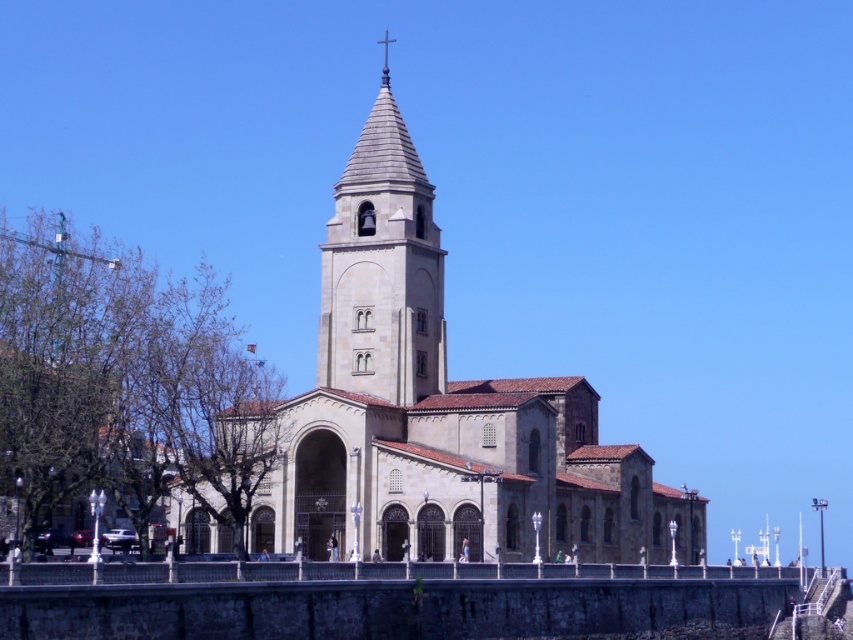
Question: Is stone church at center further to the viewer compared to gray stone bell tower at center?

Choices:
 (A) no
 (B) yes

Answer: (A)

Question: Which object appears farthest from the camera in this image?

Choices:
 (A) stone church at center
 (B) gray stone bell tower at center

Answer: (B)

Question: Does stone church at center have a lesser width compared to gray stone bell tower at center?

Choices:
 (A) yes
 (B) no

Answer: (B)

Question: Does stone church at center come in front of gray stone bell tower at center?

Choices:
 (A) no
 (B) yes

Answer: (B)

Question: Which point is closer to the camera?

Choices:
 (A) stone church at center
 (B) gray stone bell tower at center

Answer: (A)